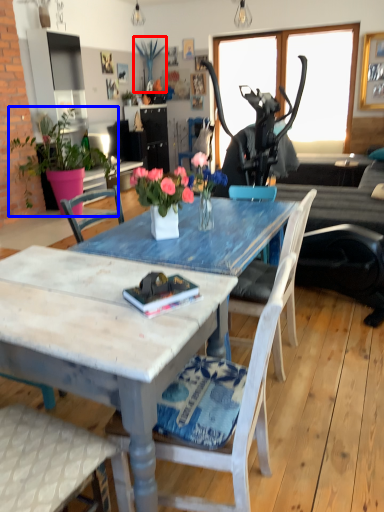
Question: Among these objects, which one is farthest to the camera, plant (highlighted by a red box) or houseplant (highlighted by a blue box)?

Choices:
 (A) plant
 (B) houseplant

Answer: (A)